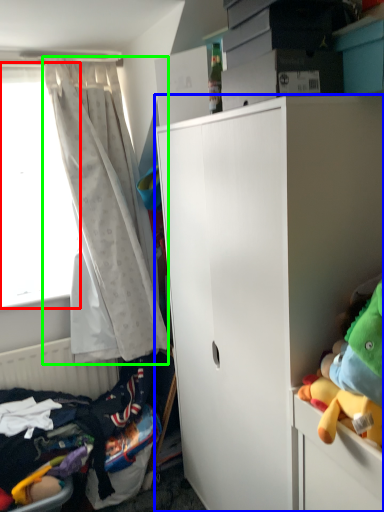
Question: Which is farther away from window screen (highlighted by a red box)? cabinetry (highlighted by a blue box) or curtain (highlighted by a green box)?

Choices:
 (A) cabinetry
 (B) curtain

Answer: (A)